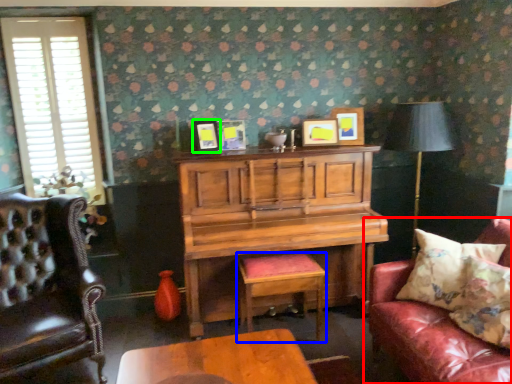
Question: Estimate the real-world distances between objects in this image. Which object is farther from studio couch (highlighted by a red box), stool (highlighted by a blue box) or picture frame (highlighted by a green box)?

Choices:
 (A) stool
 (B) picture frame

Answer: (B)